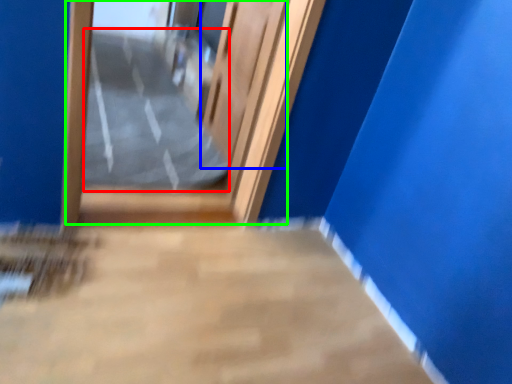
Question: Which object is positioned closest to path (highlighted by a red box)? Select from elevator door (highlighted by a blue box) and door (highlighted by a green box).

Choices:
 (A) elevator door
 (B) door

Answer: (B)